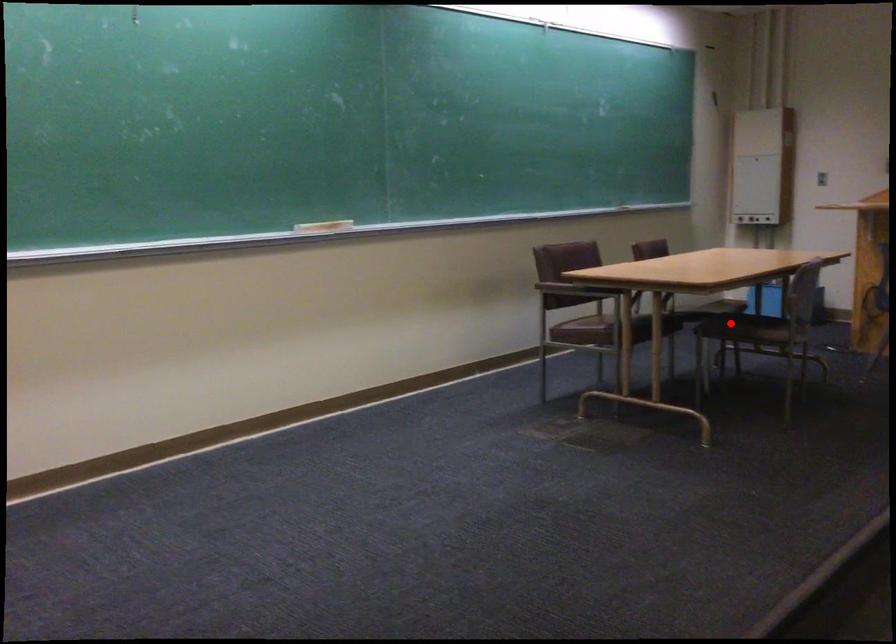
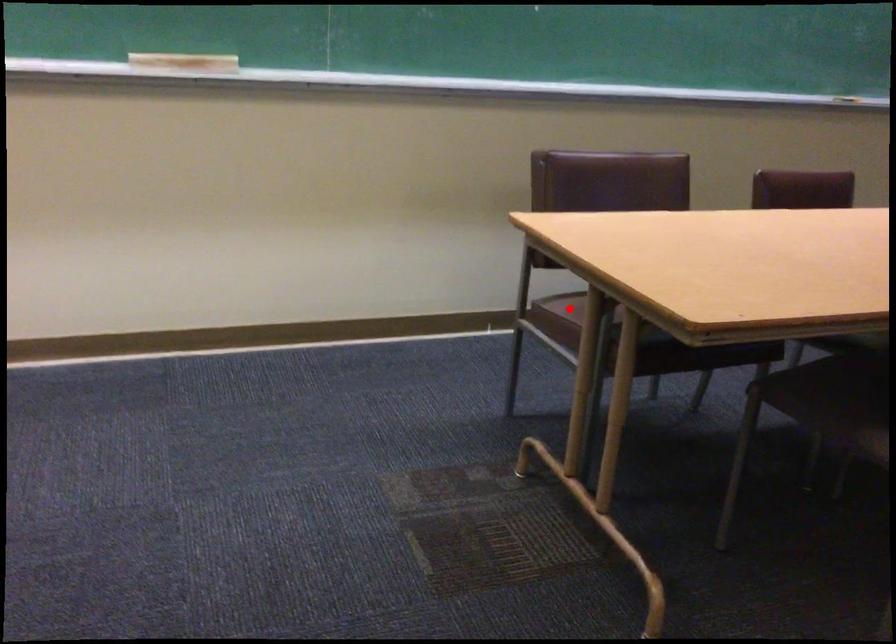
I am providing you with two images of the same scene from different viewpoints. A red point is marked on the first image and another point is marked on the second image. Is the red point in image1 aligned with the point shown in image2?

No